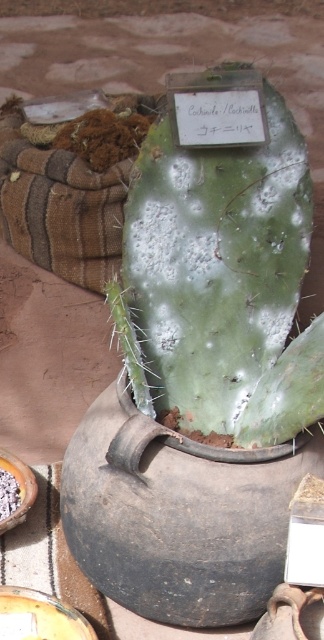
Which of these two, green matte cactus at center or white crumbly food at lower left, stands taller?

green matte cactus at center

You are a GUI agent. You are given a task and a screenshot of the screen. Output one action in this format:
    pyautogui.click(x=<x>, y=<y>)
    Task: Click on the green matte cactus at center
    This screenshot has width=324, height=640.
    Given the screenshot: What is the action you would take?
    pyautogui.click(x=219, y=273)

The width and height of the screenshot is (324, 640). What are the coordinates of `green matte cactus at center` in the screenshot? It's located at (219, 273).